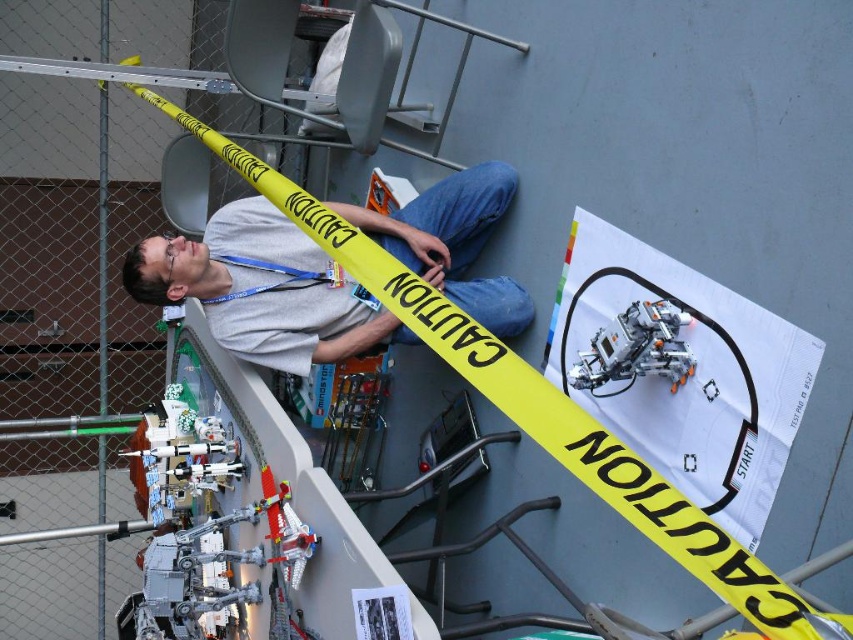
Based on the photo, is the position of gray fabric shirt at center more distant than that of metallic silver robot at center?

Yes, it is.

Can you confirm if gray fabric shirt at center is positioned to the left of metallic silver robot at center?

Correct, you'll find gray fabric shirt at center to the left of metallic silver robot at center.

Find the location of a particular element. Image resolution: width=853 pixels, height=640 pixels. gray fabric shirt at center is located at coordinates (263, 289).